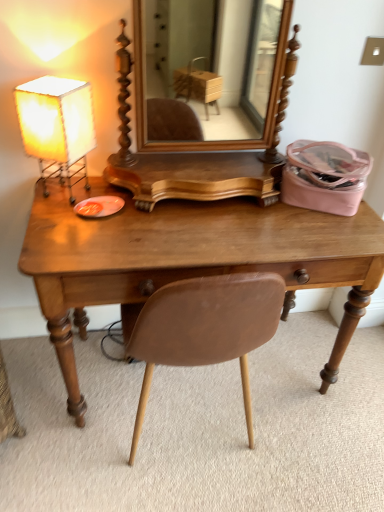
Question: Visually, is wooden desk at center positioned to the left or to the right of matte white lampshade at left?

Choices:
 (A) right
 (B) left

Answer: (A)

Question: Considering the positions of point (327, 222) and point (54, 159), is point (327, 222) closer or farther from the camera than point (54, 159)?

Choices:
 (A) farther
 (B) closer

Answer: (A)

Question: Is wooden desk at center wider or thinner than matte white lampshade at left?

Choices:
 (A) thin
 (B) wide

Answer: (B)

Question: Is matte white lampshade at left inside the boundaries of wooden desk at center, or outside?

Choices:
 (A) inside
 (B) outside

Answer: (B)

Question: From their relative heights in the image, would you say matte white lampshade at left is taller or shorter than wooden desk at center?

Choices:
 (A) tall
 (B) short

Answer: (B)

Question: In terms of size, does matte white lampshade at left appear bigger or smaller than wooden desk at center?

Choices:
 (A) small
 (B) big

Answer: (A)

Question: Is matte white lampshade at left wider or thinner than wooden desk at center?

Choices:
 (A) wide
 (B) thin

Answer: (B)